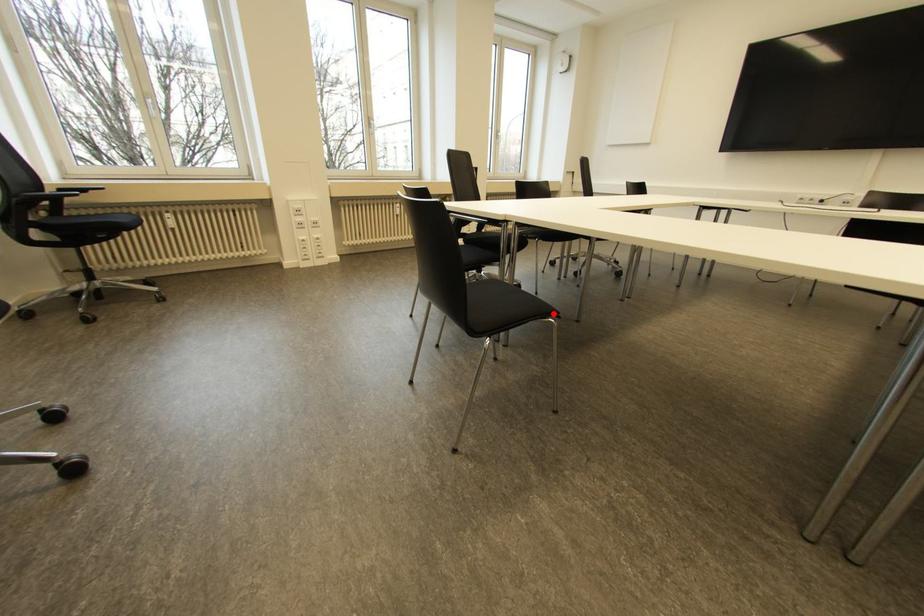
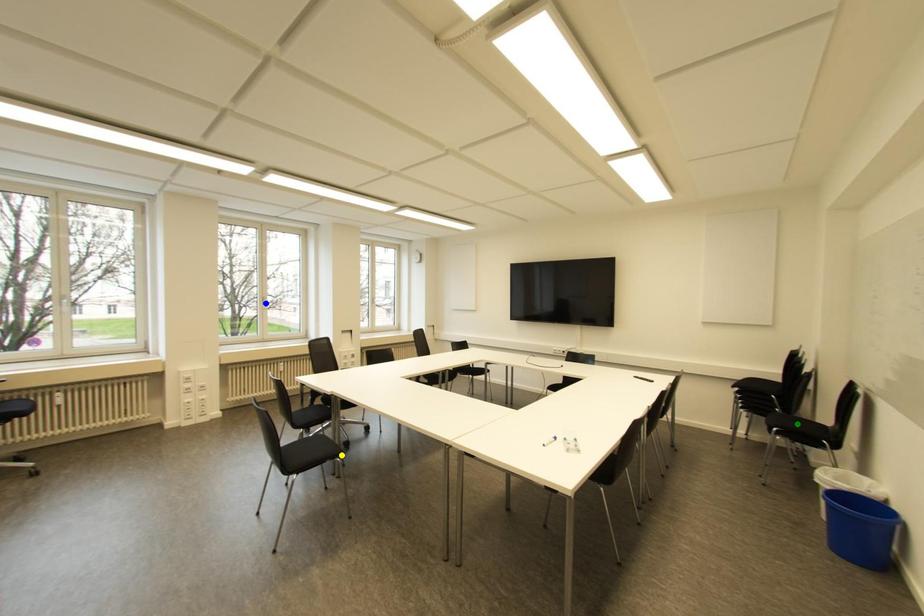
Question: I am providing you with two images of the same scene from different viewpoints. A red point is marked on the first image. You are given multiple points on the second image. In image 2, which mark is for the same physical point as the one in image 1?

Choices:
 (A) blue point
 (B) yellow point
 (C) green point

Answer: (B)